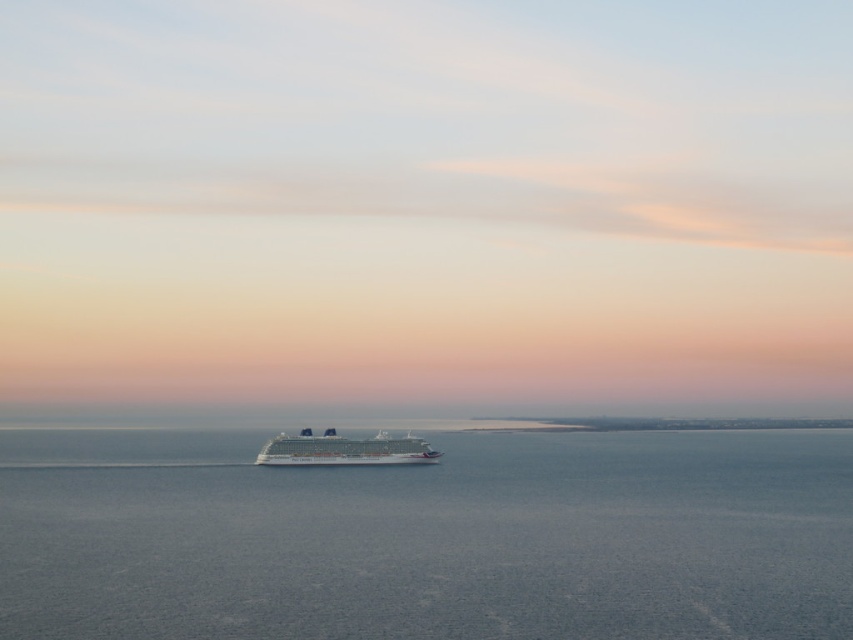
Consider the image. You are an observer standing on the shore looking at the seascape. You notice the blue water at center and the white glossy cruise ship at center. Which one of these two objects takes up more space in the image?

The blue water at center is bigger than the white glossy cruise ship at center, so it takes up more space in the image.

You are standing on the deck of the cruise ship and looking out towards the horizon. There are two points marked on the water surface in front of you. One is labeled as point 1 at coordinates point (370, 540) and the other is point 2 at coordinates point (299, 433). Which point is closer to your current position on the deck?

Point 1 at coordinates point (370, 540) is closer to your current position on the deck because it is closer to the camera than point 2 at coordinates point (299, 433).